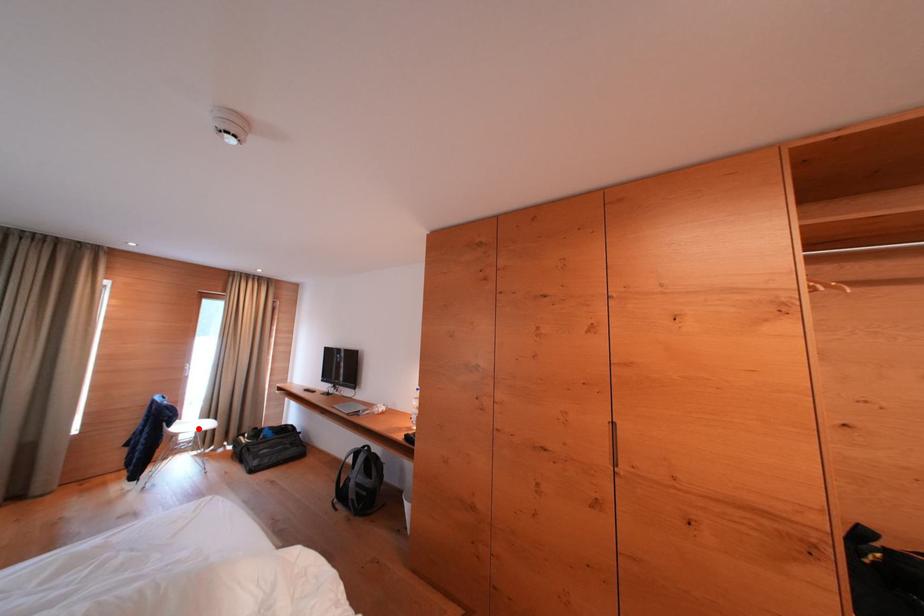
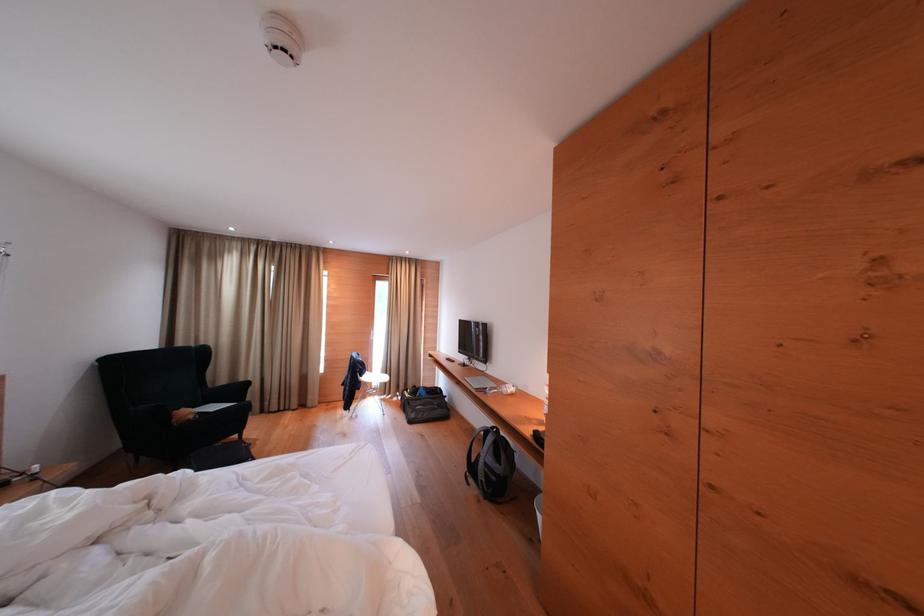
Find the pixel in the second image that matches the highlighted location in the first image.

(383, 379)